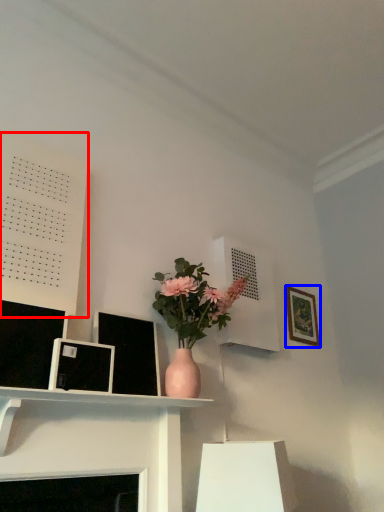
Question: Which of the following is the closest to the observer, bulletin board (highlighted by a red box) or picture frame (highlighted by a blue box)?

Choices:
 (A) bulletin board
 (B) picture frame

Answer: (A)